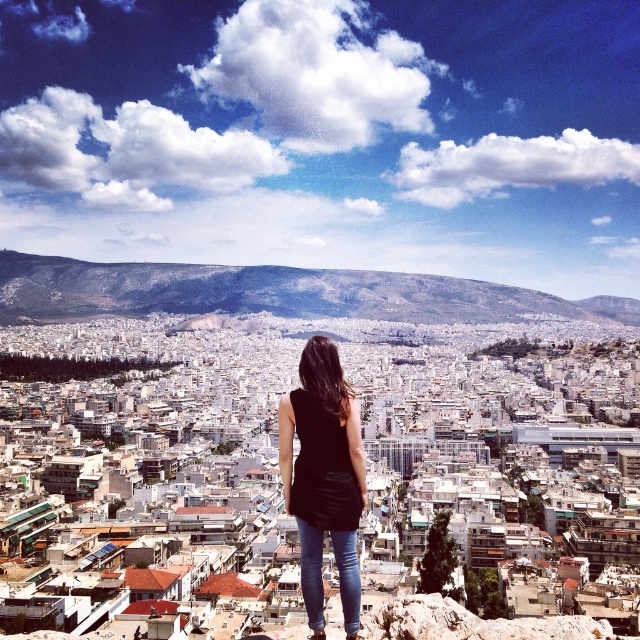
You are standing at the edge of the rocky outcrop and want to take a photo of the black matte tank top at center and the gray rocky mountain at center. Which object should you frame first in your camera to ensure both are in the shot?

You should frame the gray rocky mountain at center first since it is to the left of the black matte tank top at center, ensuring both are included in the shot.

You are a drone operator trying to capture a photo of the gray rocky mountain at center and the black matte tank top at center. Which object should you adjust your camera focus to first to ensure both are in the frame?

The gray rocky mountain at center is further to the viewer than the black matte tank top at center, so you should focus on the gray rocky mountain at center first to ensure both are in the frame.

You are a photographer standing at the rocky outcrop. You want to capture a photo that includes both the gray rocky mountain at center and the jeans at center. Which object should you ensure is in focus first to include both in the frame?

The gray rocky mountain at center is positioned over jeans at center, so you should ensure the gray rocky mountain at center is in focus first to include both in the frame.